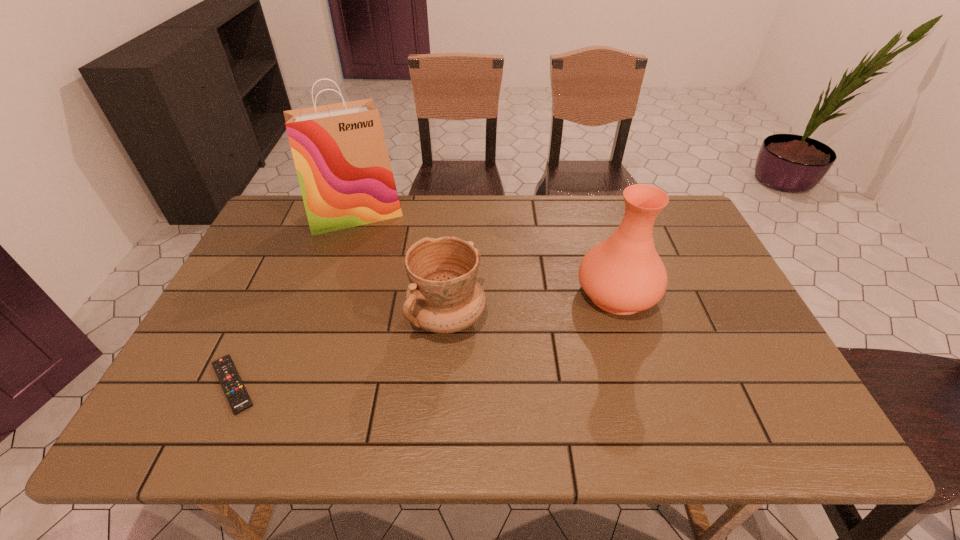
Where is `the tallest object`? This screenshot has width=960, height=540. the tallest object is located at coordinates (339, 150).

Locate an element on the screen. shopping bag is located at coordinates (339, 150).

I want to click on the rightmost object, so click(623, 274).

The image size is (960, 540). I want to click on the second tallest object, so click(x=623, y=274).

This screenshot has width=960, height=540. What are the coordinates of `the second shortest object` in the screenshot? It's located at (444, 296).

At what (x,y) coordinates should I click in order to perform the action: click on the third object from left to right. Please return your answer as a coordinate pair (x, y). The height and width of the screenshot is (540, 960). Looking at the image, I should click on (444, 296).

I want to click on the nearest object, so click(237, 396).

The width and height of the screenshot is (960, 540). In order to click on remote control in this screenshot , I will do `click(237, 396)`.

This screenshot has height=540, width=960. Identify the location of free space located on the front of the tallest object. (334, 276).

Identify the location of vacant position located on the left of the vase. This screenshot has width=960, height=540. (436, 293).